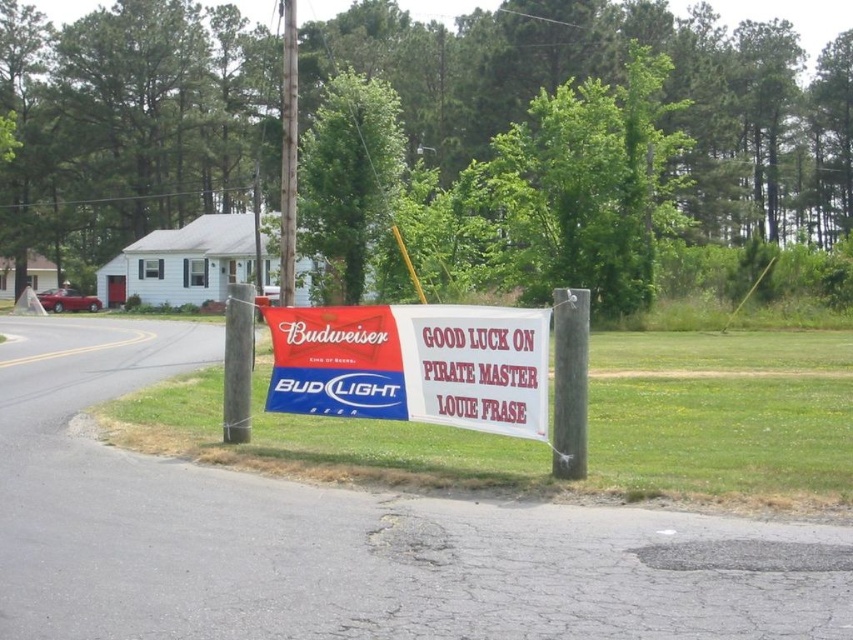
Does point (566, 416) come in front of point (291, 212)?

Yes, it is.

Identify the location of smooth gray pole at center. (x=569, y=381).

The image size is (853, 640). Identify the location of smooth gray pole at center. 569,381.

Does matte plastic banner at center have a larger size compared to metallic pole at center?

Incorrect, matte plastic banner at center is not larger than metallic pole at center.

Which of these two, matte plastic banner at center or metallic pole at center, stands shorter?

Standing shorter between the two is matte plastic banner at center.

Measure the distance between matte plastic banner at center and camera.

matte plastic banner at center and camera are 32.76 feet apart.

What are the coordinates of `matte plastic banner at center` in the screenshot? It's located at (415, 364).

Does metallic pole at center appear over metallic gray pole at center?

Indeed, metallic pole at center is positioned over metallic gray pole at center.

This screenshot has height=640, width=853. Find the location of `metallic pole at center`. metallic pole at center is located at coordinates (288, 154).

What are the coordinates of `metallic pole at center` in the screenshot? It's located at (288, 154).